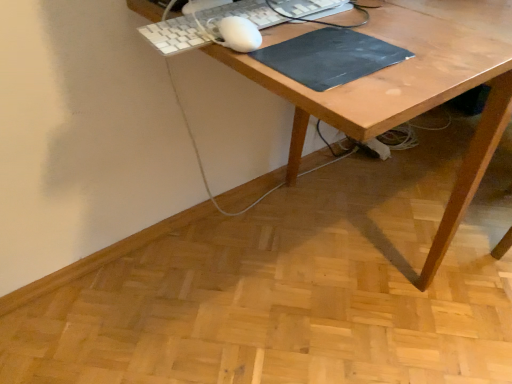
Where is `free space that is in between white plastic keyboard at upper center and black matte mousepad at center`? This screenshot has width=512, height=384. free space that is in between white plastic keyboard at upper center and black matte mousepad at center is located at coordinates (338, 29).